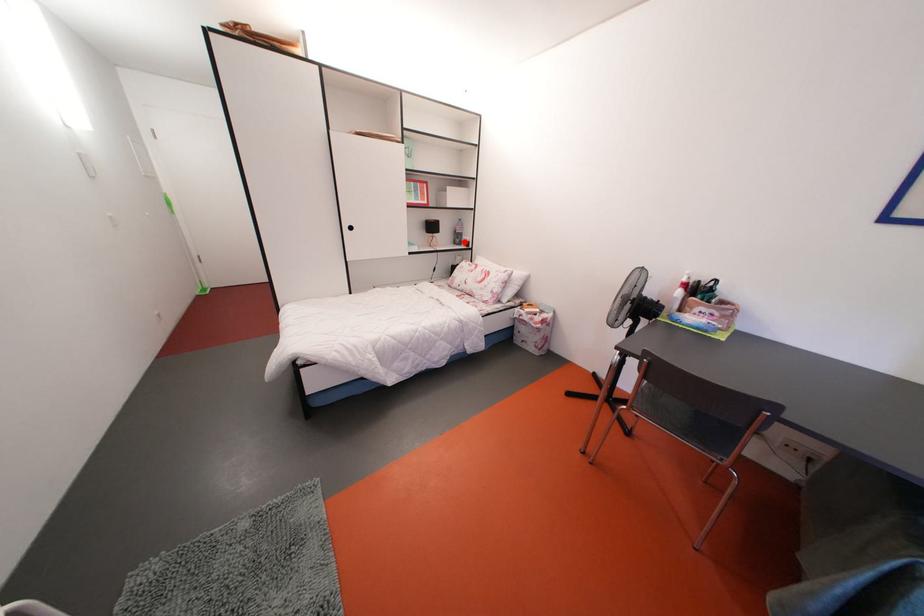
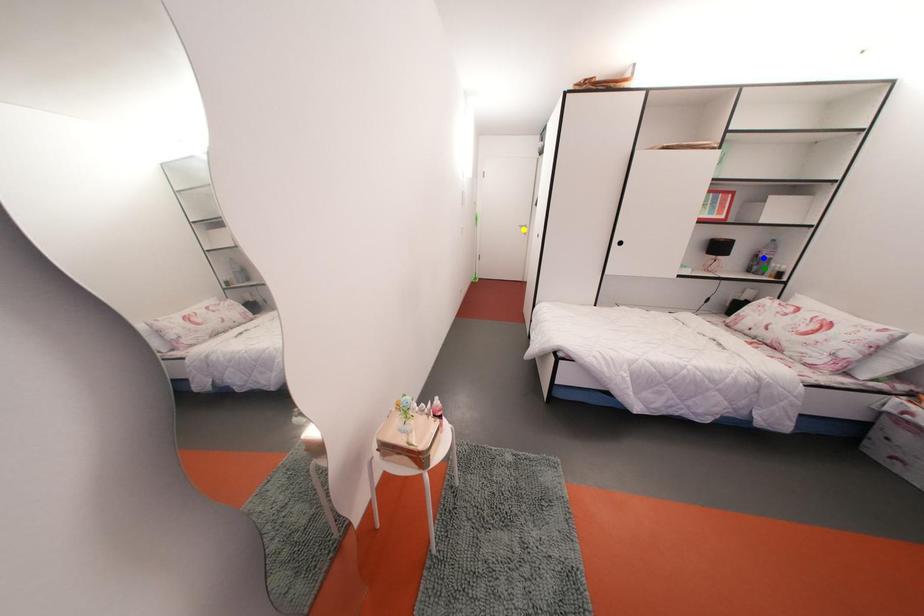
Question: I am providing you with two images of the same scene from different viewpoints. A red point is marked on the first image. You are given multiple points on the second image. Which spot in image 2 lines up with the point in image 1?

Choices:
 (A) blue point
 (B) green point
 (C) yellow point

Answer: (B)